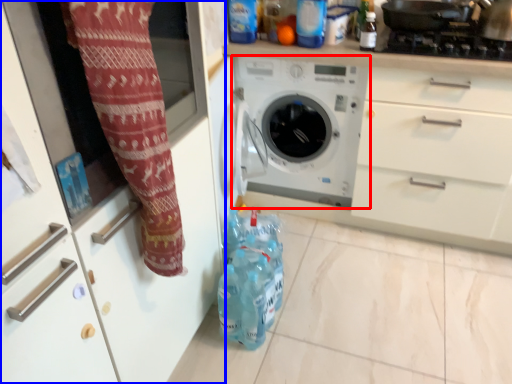
Question: Among these objects, which one is nearest to the camera, washing machine (highlighted by a red box) or cabinetry (highlighted by a blue box)?

Choices:
 (A) washing machine
 (B) cabinetry

Answer: (B)